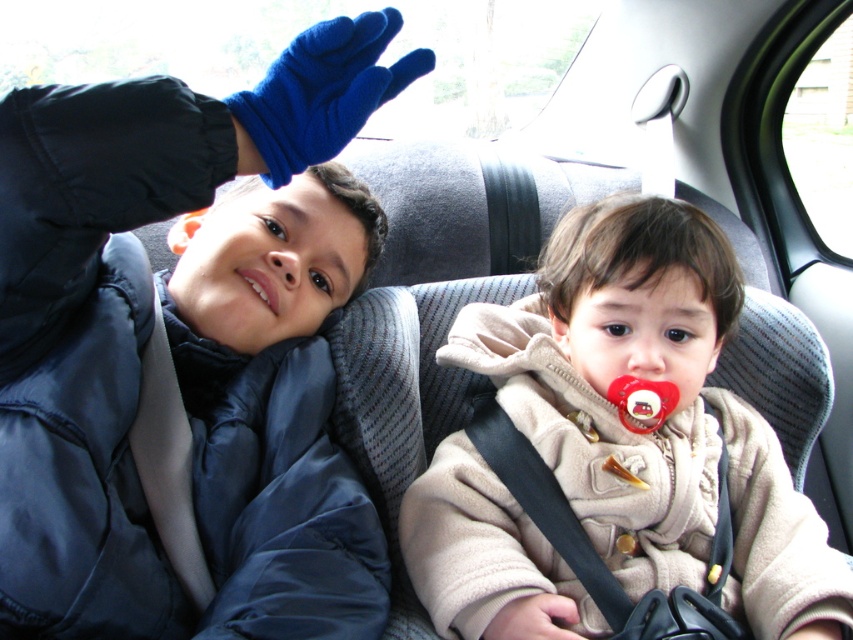
Who is positioned more to the left, matte skin nose at center or white glossy teeth at center?

From the viewer's perspective, white glossy teeth at center appears more on the left side.

Is point (285, 269) positioned behind point (257, 269)?

Yes, point (285, 269) is behind point (257, 269).

What do you see at coordinates (283, 266) in the screenshot? The width and height of the screenshot is (853, 640). I see `matte skin nose at center` at bounding box center [283, 266].

Locate an element on the screen. matte skin nose at center is located at coordinates (283, 266).

Between smooth skin nose at center and white glossy teeth at center, which one has less height?

Standing shorter between the two is white glossy teeth at center.

Which of these two, smooth skin nose at center or white glossy teeth at center, stands taller?

smooth skin nose at center is taller.

The width and height of the screenshot is (853, 640). Find the location of `smooth skin nose at center`. smooth skin nose at center is located at coordinates (648, 352).

What do you see at coordinates (664, 420) in the screenshot?
I see `beige fleece jacket at center` at bounding box center [664, 420].

Does beige fleece jacket at center appear on the left side of matte skin nose at center?

In fact, beige fleece jacket at center is to the right of matte skin nose at center.

Does point (438, 618) come closer to viewer compared to point (308, 275)?

Yes, it is.

Identify the location of beige fleece jacket at center. (664, 420).